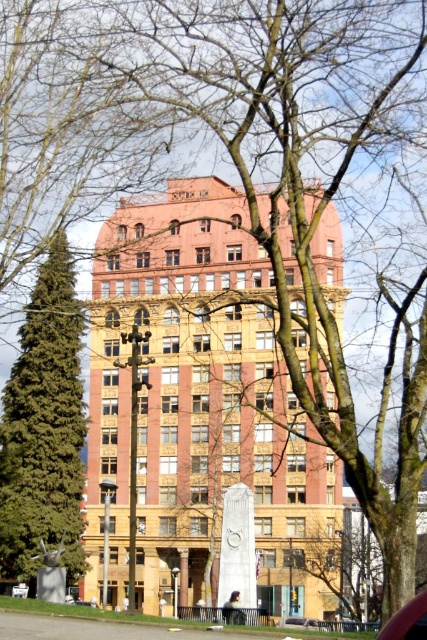
You are standing in front of the building and notice the green textured pine tree at left and the bare branches at center. Which of these two objects is positioned more to the left side?

The green textured pine tree at left is positioned more to the left side than the bare branches at center.

From the picture: You are a visitor arriving at the building and want to park your car. You see a metallic red car at lower right and a metallic silver car at center. Which car is closer to the monument?

The metallic silver car at center is closer to the monument because the metallic red car at lower right is positioned on the right side of it, meaning the silver car is between the monument and the red car.

From the picture: You are a photographer planning to capture a wide shot of the building and its surroundings. Given that the green textured pine tree at left and the metallic silver car at center are both in the frame, which object occupies more horizontal space in the photo?

The green textured pine tree at left is wider than the metallic silver car at center, so it occupies more horizontal space in the photo.